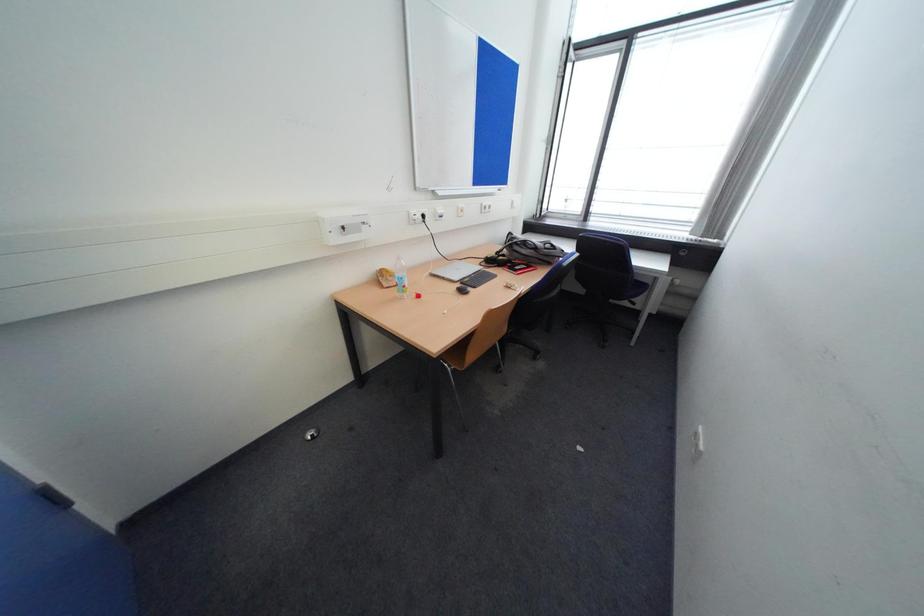
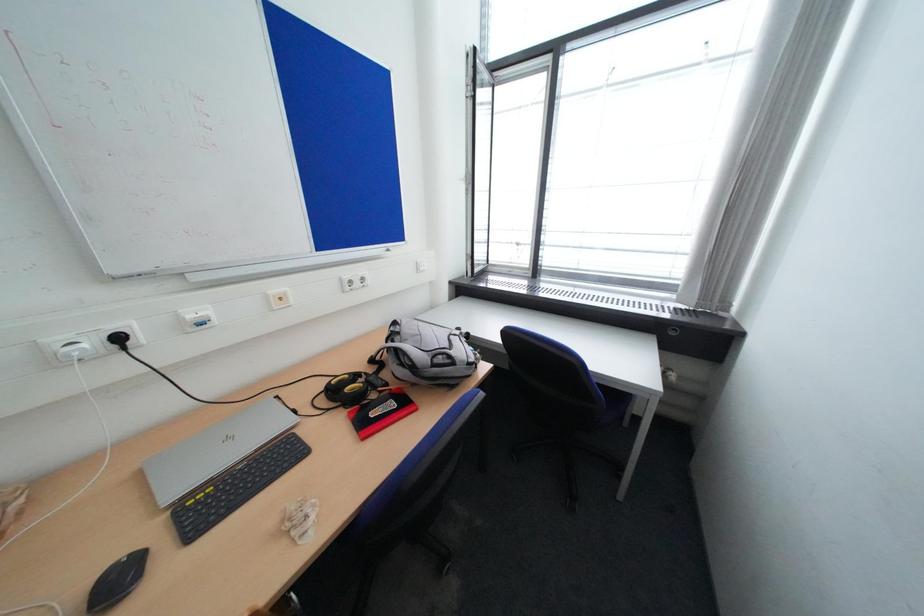
In a continuous first-person perspective shot, in which direction is the camera moving?

The cameraman moved toward right, forward.